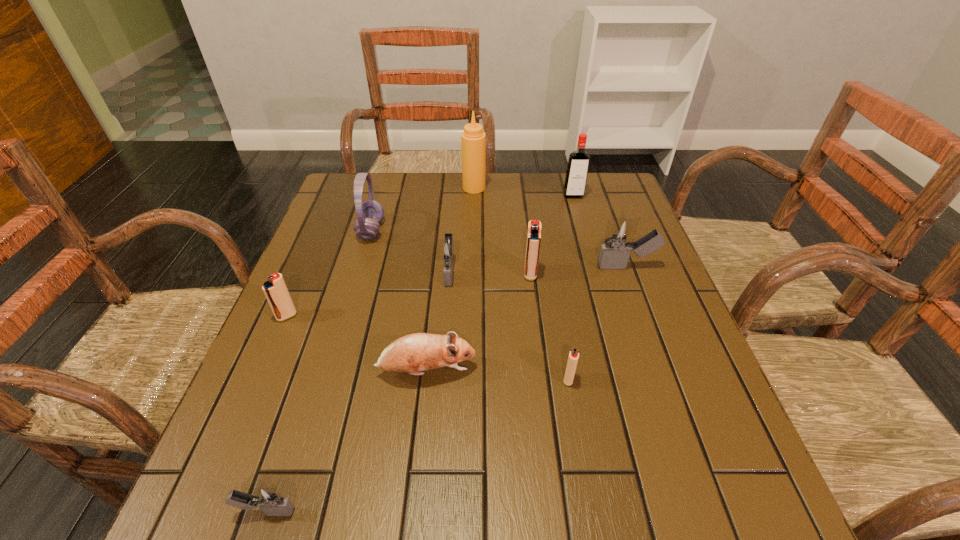
This screenshot has width=960, height=540. I want to click on object that is at the near edge, so click(x=269, y=500).

Where is `headset positioned at the left edge`? headset positioned at the left edge is located at coordinates (369, 213).

Image resolution: width=960 pixels, height=540 pixels. I want to click on vodka at the right edge, so 578,162.

The image size is (960, 540). I want to click on igniter that is positioned at the right edge, so click(x=620, y=232).

Locate an element on the screen. This screenshot has width=960, height=540. object that is at the far left corner is located at coordinates (369, 213).

You are a GUI agent. You are given a task and a screenshot of the screen. Output one action in this format:
    pyautogui.click(x=<x>, y=<y>)
    Task: Click on the object that is at the near left corner
    
    Given the screenshot: What is the action you would take?
    pyautogui.click(x=269, y=500)

Locate an element on the screen. object situated at the far right corner is located at coordinates (578, 162).

Where is `vacant space at the far edge of the desktop`? This screenshot has width=960, height=540. vacant space at the far edge of the desktop is located at coordinates [x=429, y=214].

Image resolution: width=960 pixels, height=540 pixels. In order to click on vacant space at the left edge in this screenshot , I will do 321,375.

Identify the location of vacant space at the right edge of the desktop. The image size is (960, 540). (610, 299).